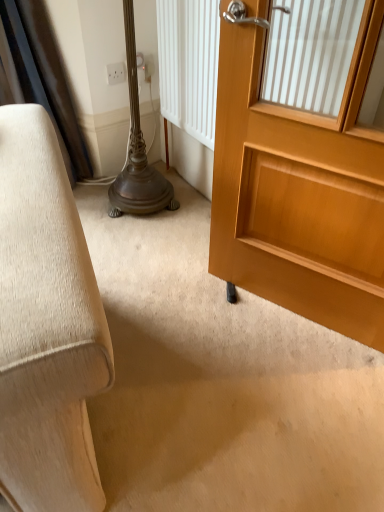
You are a GUI agent. You are given a task and a screenshot of the screen. Output one action in this format:
    pyautogui.click(x=<x>, y=<y>)
    Task: Click on the white plastic electric outlet at upper center
    The height and width of the screenshot is (512, 384).
    Given the screenshot: What is the action you would take?
    pyautogui.click(x=116, y=73)

What do you see at coordinates (116, 73) in the screenshot?
I see `white plastic electric outlet at upper center` at bounding box center [116, 73].

Measure the distance between light brown wooden door at right and camera.

light brown wooden door at right and camera are 86.66 centimeters apart from each other.

Describe the element at coordinates (299, 193) in the screenshot. I see `light brown wooden door at right` at that location.

Locate an element on the screen. light brown wooden door at right is located at coordinates (299, 193).

Find the location of a particular element. white plastic electric outlet at upper center is located at coordinates (116, 73).

Based on their positions, is light brown wooden door at right located to the left or right of white plastic electric outlet at upper center?

From the image, it's evident that light brown wooden door at right is to the right of white plastic electric outlet at upper center.

Does light brown wooden door at right lie behind white plastic electric outlet at upper center?

No, light brown wooden door at right is closer to the viewer.

Which is nearer, (347, 271) or (108, 82)?

Point (347, 271) appears to be closer to the viewer than point (108, 82).

From the image's perspective, is light brown wooden door at right below white plastic electric outlet at upper center?

Yes, from the image's perspective, light brown wooden door at right is beneath white plastic electric outlet at upper center.

From a real-world perspective, relative to white plastic electric outlet at upper center, is light brown wooden door at right vertically above or below?

light brown wooden door at right is above white plastic electric outlet at upper center.

Which object is wider, light brown wooden door at right or white plastic electric outlet at upper center?

With larger width is light brown wooden door at right.

Considering the relative sizes of light brown wooden door at right and white plastic electric outlet at upper center in the image provided, is light brown wooden door at right shorter than white plastic electric outlet at upper center?

Incorrect, the height of light brown wooden door at right does not fall short of that of white plastic electric outlet at upper center.

Who is bigger, light brown wooden door at right or white plastic electric outlet at upper center?

With larger size is light brown wooden door at right.

Is light brown wooden door at right surrounding white plastic electric outlet at upper center?

No, white plastic electric outlet at upper center is located outside of light brown wooden door at right.

Is light brown wooden door at right next to white plastic electric outlet at upper center and touching it?

light brown wooden door at right and white plastic electric outlet at upper center are clearly separated.

Is light brown wooden door at right oriented away from white plastic electric outlet at upper center?

No, light brown wooden door at right is not facing the opposite direction of white plastic electric outlet at upper center.

Where is `door to the right of white plastic electric outlet at upper center`? Image resolution: width=384 pixels, height=512 pixels. door to the right of white plastic electric outlet at upper center is located at coordinates (299, 193).

Which object is positioned more to the right, white plastic electric outlet at upper center or light brown wooden door at right?

light brown wooden door at right.

Considering their positions, is white plastic electric outlet at upper center located in front of or behind light brown wooden door at right?

In the image, white plastic electric outlet at upper center appears behind light brown wooden door at right.

Which point is more forward, (110, 64) or (338, 318)?

Positioned in front is point (338, 318).

From the image's perspective, which one is positioned higher, white plastic electric outlet at upper center or light brown wooden door at right?

white plastic electric outlet at upper center, from the image's perspective.

From a real-world perspective, which object stands above the other?

light brown wooden door at right is physically above.

Can you confirm if white plastic electric outlet at upper center is thinner than light brown wooden door at right?

Yes, white plastic electric outlet at upper center is thinner than light brown wooden door at right.

Which of these two, white plastic electric outlet at upper center or light brown wooden door at right, stands taller?

Standing taller between the two is light brown wooden door at right.

Looking at this image, which of these two, white plastic electric outlet at upper center or light brown wooden door at right, is smaller?

white plastic electric outlet at upper center.

Is white plastic electric outlet at upper center inside the boundaries of light brown wooden door at right, or outside?

The correct answer is: outside.

Is white plastic electric outlet at upper center with light brown wooden door at right?

white plastic electric outlet at upper center and light brown wooden door at right are not in contact.

Does white plastic electric outlet at upper center turn towards light brown wooden door at right?

Yes, white plastic electric outlet at upper center is oriented towards light brown wooden door at right.

Can you tell me how much white plastic electric outlet at upper center and light brown wooden door at right differ in facing direction?

70 degrees separate the facing orientations of white plastic electric outlet at upper center and light brown wooden door at right.

How much distance is there between white plastic electric outlet at upper center and light brown wooden door at right?

white plastic electric outlet at upper center is 1.11 meters from light brown wooden door at right.

The height and width of the screenshot is (512, 384). I want to click on electric outlet on the left side of light brown wooden door at right, so click(116, 73).

Image resolution: width=384 pixels, height=512 pixels. I want to click on door below the white plastic electric outlet at upper center (from the image's perspective), so click(x=299, y=193).

Identify the location of door on the right of white plastic electric outlet at upper center. (299, 193).